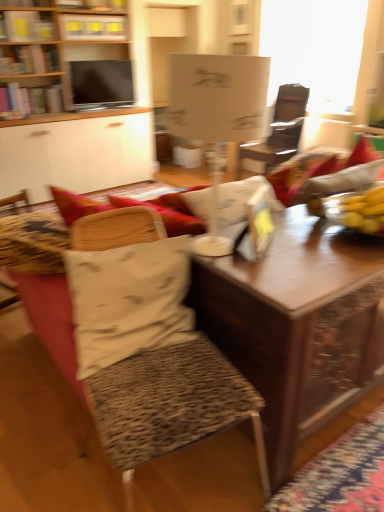
Find the location of a particular element. The height and width of the screenshot is (512, 384). vacant area that lies to the right of white matte lampshade at center is located at coordinates (311, 246).